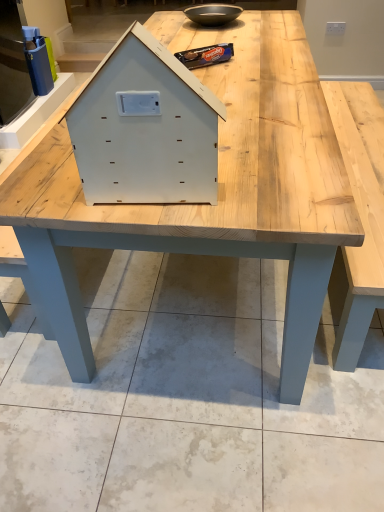
Question: From a real-world perspective, is light wood table at center on top of matte black bowl at upper center?

Choices:
 (A) no
 (B) yes

Answer: (A)

Question: Is light wood table at center at the left side of matte black bowl at upper center?

Choices:
 (A) no
 (B) yes

Answer: (B)

Question: Does light wood table at center come behind matte black bowl at upper center?

Choices:
 (A) no
 (B) yes

Answer: (A)

Question: Considering the relative sizes of light wood table at center and matte black bowl at upper center in the image provided, is light wood table at center thinner than matte black bowl at upper center?

Choices:
 (A) yes
 (B) no

Answer: (B)

Question: Is there a large distance between light wood table at center and matte black bowl at upper center?

Choices:
 (A) yes
 (B) no

Answer: (B)

Question: From the image's perspective, is light wood table at center above or below white matte wooden house at center?

Choices:
 (A) below
 (B) above

Answer: (B)

Question: Considering the positions of point (43, 129) and point (135, 96), is point (43, 129) closer or farther from the camera than point (135, 96)?

Choices:
 (A) farther
 (B) closer

Answer: (A)

Question: Relative to white matte wooden house at center, is light wood table at center in front or behind?

Choices:
 (A) behind
 (B) front

Answer: (A)

Question: Considering the positions of light wood table at center and white matte wooden house at center in the image, is light wood table at center wider or thinner than white matte wooden house at center?

Choices:
 (A) thin
 (B) wide

Answer: (B)

Question: Is light wood table at center in front of or behind matte black bowl at upper center in the image?

Choices:
 (A) front
 (B) behind

Answer: (A)

Question: From the image's perspective, is light wood table at center above or below matte black bowl at upper center?

Choices:
 (A) below
 (B) above

Answer: (A)

Question: Looking at their shapes, would you say light wood table at center is wider or thinner than matte black bowl at upper center?

Choices:
 (A) thin
 (B) wide

Answer: (B)

Question: Looking at the image, does light wood table at center seem bigger or smaller compared to matte black bowl at upper center?

Choices:
 (A) small
 (B) big

Answer: (B)

Question: Is white matte wooden house at center wider or thinner than light wood table at center?

Choices:
 (A) thin
 (B) wide

Answer: (A)

Question: From the image's perspective, is white matte wooden house at center located above or below light wood table at center?

Choices:
 (A) below
 (B) above

Answer: (A)